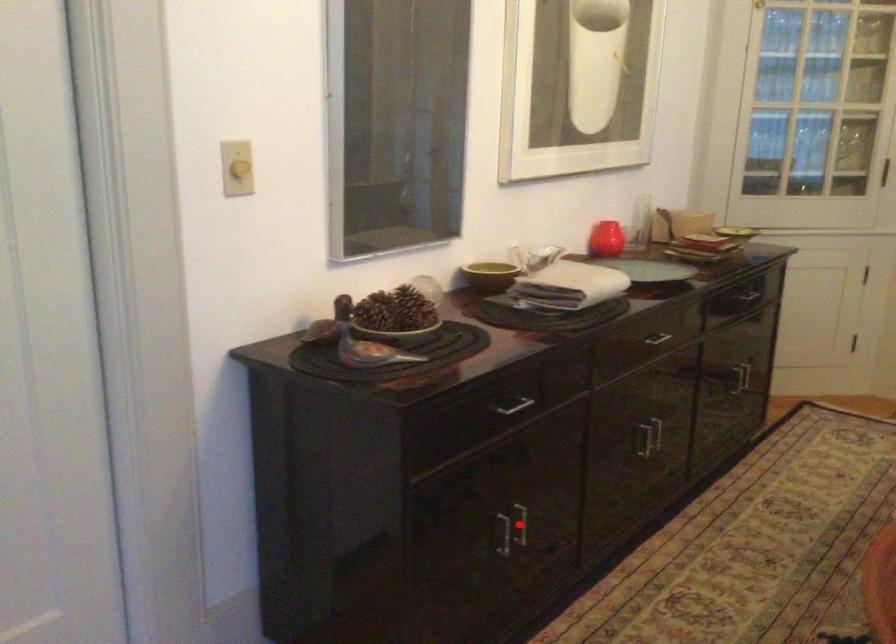
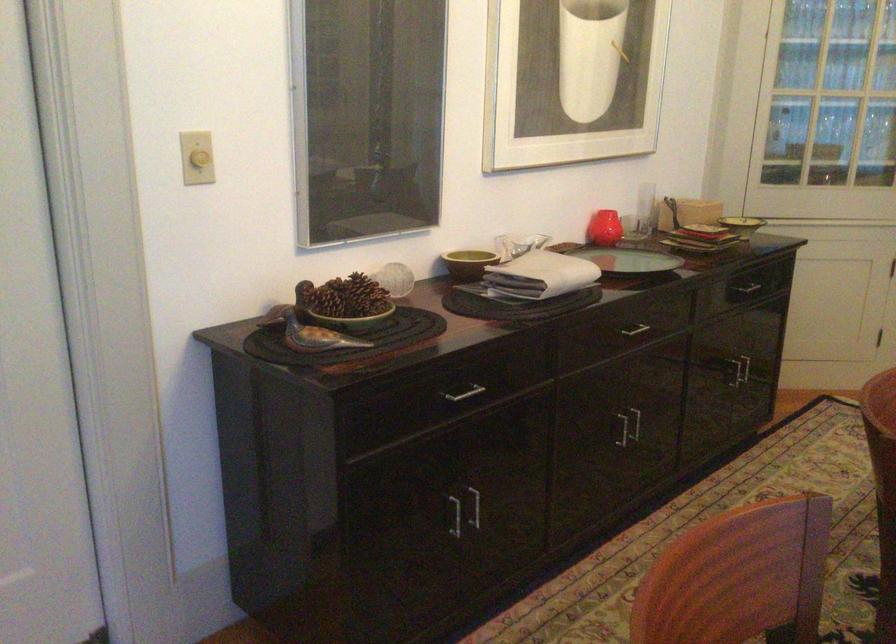
Where in the second image is the point corresponding to the highlighted location from the first image?

(474, 507)